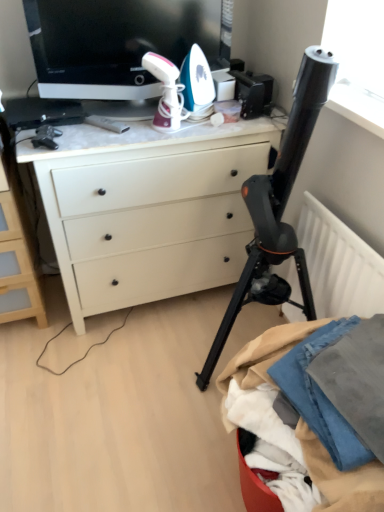
Question: Considering the relative sizes of black matte tripod at center and white matte radiator at right in the image provided, is black matte tripod at center shorter than white matte radiator at right?

Choices:
 (A) yes
 (B) no

Answer: (B)

Question: From a real-world perspective, is black matte tripod at center below white matte radiator at right?

Choices:
 (A) yes
 (B) no

Answer: (B)

Question: Is black matte tripod at center wider than white matte radiator at right?

Choices:
 (A) no
 (B) yes

Answer: (B)

Question: From the image's perspective, is black matte tripod at center on white matte radiator at right?

Choices:
 (A) yes
 (B) no

Answer: (A)

Question: Does black matte tripod at center contain white matte radiator at right?

Choices:
 (A) no
 (B) yes

Answer: (A)

Question: Is white matte radiator at right to the left or to the right of denim fabric at lower right in the image?

Choices:
 (A) left
 (B) right

Answer: (B)

Question: Do you think white matte radiator at right is within denim fabric at lower right, or outside of it?

Choices:
 (A) outside
 (B) inside

Answer: (A)

Question: In terms of size, does white matte radiator at right appear bigger or smaller than denim fabric at lower right?

Choices:
 (A) small
 (B) big

Answer: (A)

Question: Looking at their shapes, would you say white matte radiator at right is wider or thinner than denim fabric at lower right?

Choices:
 (A) wide
 (B) thin

Answer: (B)

Question: Considering the positions of white matte radiator at right and black matte tripod at center in the image, is white matte radiator at right taller or shorter than black matte tripod at center?

Choices:
 (A) short
 (B) tall

Answer: (A)

Question: From the image's perspective, is white matte radiator at right positioned above or below black matte tripod at center?

Choices:
 (A) above
 (B) below

Answer: (B)

Question: In the image, is white matte radiator at right on the left side or the right side of black matte tripod at center?

Choices:
 (A) left
 (B) right

Answer: (B)

Question: From a real-world perspective, is white matte radiator at right above or below black matte tripod at center?

Choices:
 (A) above
 (B) below

Answer: (B)

Question: Choose the correct answer: Is white matte desk at center inside black glossy television at upper center or outside it?

Choices:
 (A) inside
 (B) outside

Answer: (B)

Question: Considering their positions, is white matte desk at center located in front of or behind black glossy television at upper center?

Choices:
 (A) behind
 (B) front

Answer: (A)